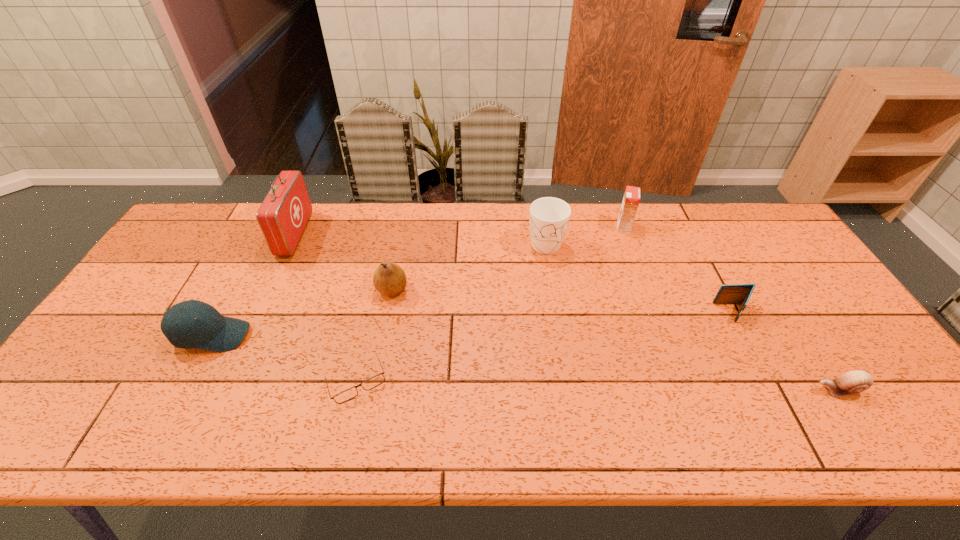
This screenshot has height=540, width=960. Identify the location of unoccupied area between the spectacles and the mug. (451, 311).

Image resolution: width=960 pixels, height=540 pixels. In order to click on empty space between the second object from right to left and the fourth object from right to left in this screenshot , I will do `click(639, 277)`.

Locate an element on the screen. This screenshot has width=960, height=540. vacant space in between the tallest object and the baseball cap is located at coordinates (253, 285).

At what (x,y) coordinates should I click in order to perform the action: click on blank region between the fifth nearest object and the rightmost object. Please return your answer as a coordinate pair (x, y). The image size is (960, 540). Looking at the image, I should click on (614, 340).

Locate an element on the screen. free space between the fourth farthest object and the fifth object from left to right is located at coordinates (468, 265).

You are a GUI agent. You are given a task and a screenshot of the screen. Output one action in this format:
    pyautogui.click(x=<x>, y=<y>)
    Task: Click on the vacant area that lies between the escargot and the wallet
    
    Given the screenshot: What is the action you would take?
    pyautogui.click(x=785, y=352)

Identify which object is located as the seventh nearest to the mug. Please provide its 2D coordinates. Your answer should be formatted as a tuple, i.e. [(x, y)], where the tuple contains the x and y coordinates of a point satisfying the conditions above.

[(211, 331)]

Where is `the closest object relative to the baseball cap`? the closest object relative to the baseball cap is located at coordinates (283, 215).

This screenshot has width=960, height=540. In order to click on free location that satisfies the following two spatial constraints: 1. on the side of the first-aid kit with the first aid cross symbol; 2. on the left side of the pear in this screenshot , I will do `click(269, 289)`.